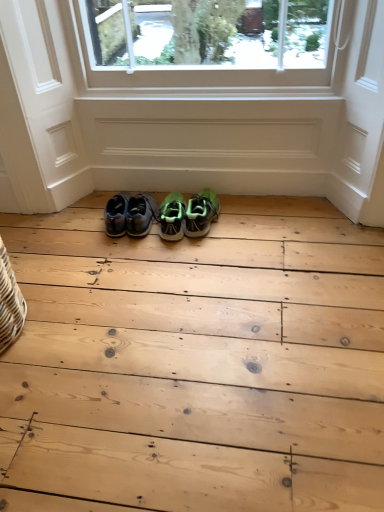
Question: Considering the relative sizes of matte black sneakers at center, acting as the 1th footwear starting from the left, and green mesh sneakers at center, which ranks as the 1th footwear in right-to-left order, in the image provided, is matte black sneakers at center, acting as the 1th footwear starting from the left, thinner than green mesh sneakers at center, which ranks as the 1th footwear in right-to-left order,?

Choices:
 (A) no
 (B) yes

Answer: (A)

Question: Can you confirm if matte black sneakers at center, acting as the 3th footwear starting from the right, is positioned to the right of green mesh sneakers at center, which ranks as the 1th footwear in right-to-left order?

Choices:
 (A) no
 (B) yes

Answer: (A)

Question: From a real-world perspective, is matte black sneakers at center, acting as the 3th footwear starting from the right, on green mesh sneakers at center, which is the third footwear in left-to-right order?

Choices:
 (A) yes
 (B) no

Answer: (A)

Question: Does matte black sneakers at center, acting as the 3th footwear starting from the right, have a lesser height compared to green mesh sneakers at center, which ranks as the 1th footwear in right-to-left order?

Choices:
 (A) yes
 (B) no

Answer: (B)

Question: Is matte black sneakers at center, acting as the 3th footwear starting from the right, placed right next to green mesh sneakers at center, which ranks as the 1th footwear in right-to-left order?

Choices:
 (A) no
 (B) yes

Answer: (A)

Question: Considering the positions of point (x=148, y=224) and point (x=200, y=198), is point (x=148, y=224) closer or farther from the camera than point (x=200, y=198)?

Choices:
 (A) closer
 (B) farther

Answer: (A)

Question: Which is correct: matte black sneakers at center, acting as the 1th footwear starting from the left, is inside green mesh sneakers at center, which is the third footwear in left-to-right order, or outside of it?

Choices:
 (A) inside
 (B) outside

Answer: (B)

Question: Considering the relative positions of matte black sneakers at center, acting as the 1th footwear starting from the left, and green mesh sneakers at center, which is the third footwear in left-to-right order, in the image provided, is matte black sneakers at center, acting as the 1th footwear starting from the left, to the left or to the right of green mesh sneakers at center, which is the third footwear in left-to-right order,?

Choices:
 (A) right
 (B) left

Answer: (B)

Question: Is matte black sneakers at center, acting as the 1th footwear starting from the left, wider or thinner than green mesh sneakers at center, which is the third footwear in left-to-right order?

Choices:
 (A) wide
 (B) thin

Answer: (A)

Question: Considering the positions of point (173, 208) and point (195, 230), is point (173, 208) closer or farther from the camera than point (195, 230)?

Choices:
 (A) farther
 (B) closer

Answer: (A)

Question: Is green matte sneakers at center, which appears as the 2th footwear when viewed from the left, spatially inside green mesh sneakers at center, which is the third footwear in left-to-right order, or outside of it?

Choices:
 (A) outside
 (B) inside

Answer: (A)

Question: In the image, is green matte sneakers at center, which is the second footwear in right-to-left order, on the left side or the right side of green mesh sneakers at center, which is the third footwear in left-to-right order?

Choices:
 (A) right
 (B) left

Answer: (B)

Question: Based on their sizes in the image, would you say green matte sneakers at center, which is the second footwear in right-to-left order, is bigger or smaller than green mesh sneakers at center, which ranks as the 1th footwear in right-to-left order?

Choices:
 (A) small
 (B) big

Answer: (B)

Question: From a real-world perspective, is matte black sneakers at center, acting as the 3th footwear starting from the right, above or below green matte sneakers at center, which is the second footwear in right-to-left order?

Choices:
 (A) below
 (B) above

Answer: (B)

Question: In terms of height, does matte black sneakers at center, acting as the 1th footwear starting from the left, look taller or shorter compared to green matte sneakers at center, which is the second footwear in right-to-left order?

Choices:
 (A) tall
 (B) short

Answer: (A)